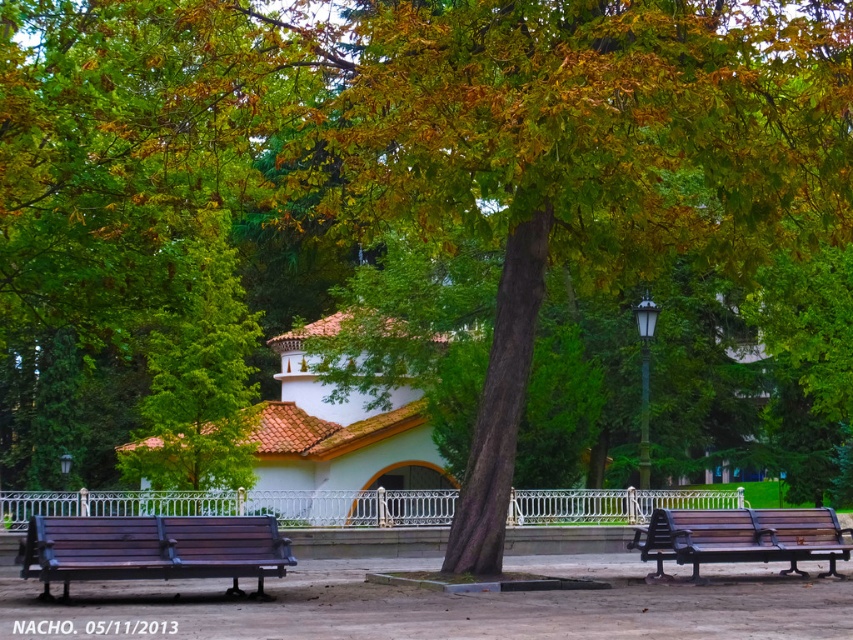
You are a visitor in the park and want to take a photo of the white matte chapel at center from the brown wooden bench at right. Can you see the chapel clearly from that bench?

The white matte chapel at center is to the left of the brown wooden bench at right, so yes, the chapel should be visible from the bench as they are positioned side by side with the chapel on the left and the bench on the right.